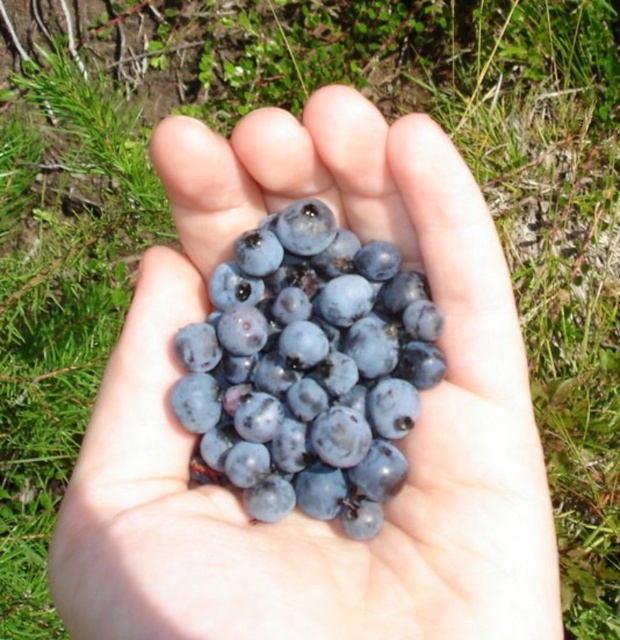
Can you confirm if glossy blueberries at center is positioned to the right of shiny dark blue grapes at center?

Indeed, glossy blueberries at center is positioned on the right side of shiny dark blue grapes at center.

Between point (288, 579) and point (372, 381), which one is positioned behind?

The point (372, 381) is more distant.

Who is more forward, [312,634] or [350,448]?

Point [312,634] is more forward.

In order to click on glossy blueberries at center in this screenshot , I will do `click(401, 440)`.